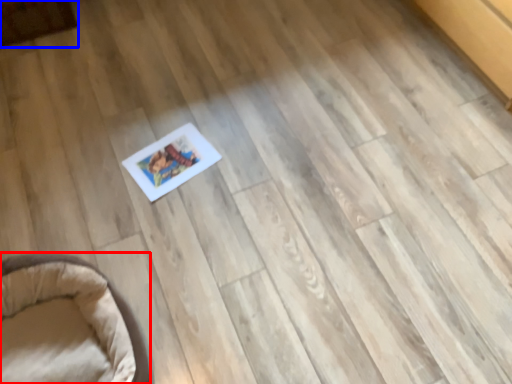
Question: Among these objects, which one is farthest to the camera, furniture (highlighted by a red box) or furniture (highlighted by a blue box)?

Choices:
 (A) furniture
 (B) furniture

Answer: (B)